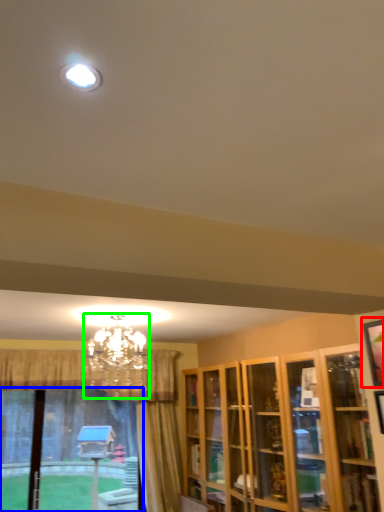
Question: Which is nearer to the picture frame (highlighted by a red box)? bay window (highlighted by a blue box) or lamp (highlighted by a green box).

Choices:
 (A) bay window
 (B) lamp

Answer: (B)